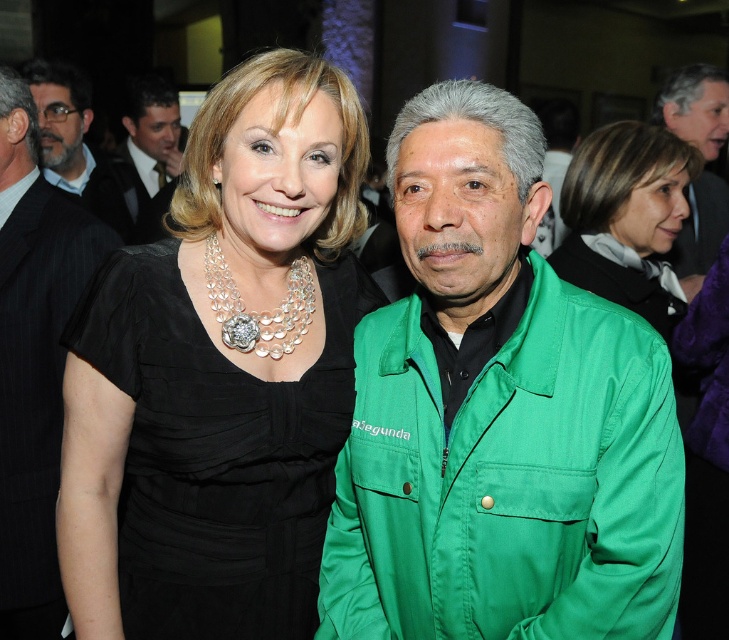
Does point (495, 500) come in front of point (674, 128)?

Yes, it is.

Does green fabric jacket at center appear over matte green jacket at right?

Incorrect, green fabric jacket at center is not positioned above matte green jacket at right.

What do you see at coordinates (498, 416) in the screenshot? The image size is (729, 640). I see `green fabric jacket at center` at bounding box center [498, 416].

The image size is (729, 640). Identify the location of green fabric jacket at center. (498, 416).

Who is positioned more to the left, matte black dress at center or matte black suit at upper left?

matte black suit at upper left

Between matte black dress at center and matte black suit at upper left, which one is positioned lower?

matte black dress at center is below.

Is point (588, 241) less distant than point (155, 80)?

Yes, it is in front of point (155, 80).

Locate an element on the screen. Image resolution: width=729 pixels, height=640 pixels. matte black dress at center is located at coordinates (625, 218).

Is point (35, 156) positioned in front of point (701, 276)?

Yes, it is in front of point (701, 276).

Identify the location of black pinstripe suit at center. Image resolution: width=729 pixels, height=640 pixels. (34, 360).